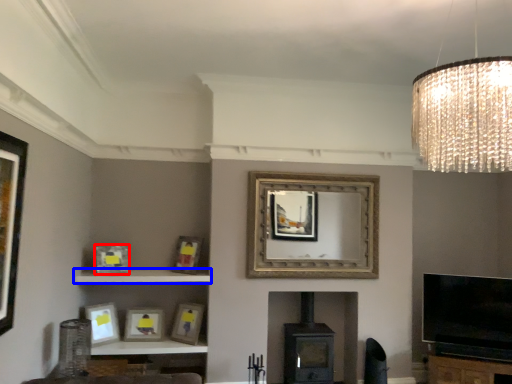
Question: Among these objects, which one is farthest to the camera, picture frame (highlighted by a red box) or shelf (highlighted by a blue box)?

Choices:
 (A) picture frame
 (B) shelf

Answer: (A)